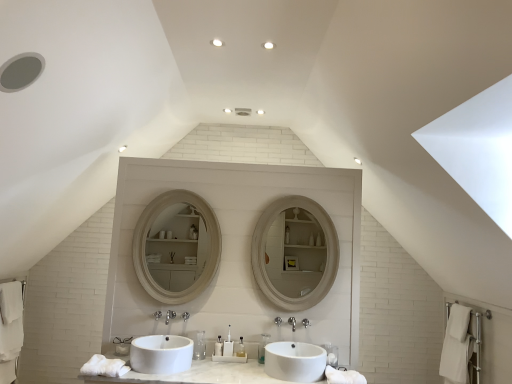
Question: Could you tell me if translucent plastic toothbrush at center, the 1th toiletry in the right-to-left sequence, is facing matte white mirror at center?

Choices:
 (A) no
 (B) yes

Answer: (A)

Question: Considering the relative positions of translucent plastic toothbrush at center, the 1th toiletry in the right-to-left sequence, and matte white mirror at center in the image provided, is translucent plastic toothbrush at center, the 1th toiletry in the right-to-left sequence, in front of matte white mirror at center?

Choices:
 (A) no
 (B) yes

Answer: (B)

Question: Is translucent plastic toothbrush at center, arranged as the 6th toiletry when viewed from the left, shorter than matte white mirror at center?

Choices:
 (A) yes
 (B) no

Answer: (A)

Question: Considering the relative sizes of translucent plastic toothbrush at center, the 1th toiletry in the right-to-left sequence, and matte white mirror at center in the image provided, is translucent plastic toothbrush at center, the 1th toiletry in the right-to-left sequence, thinner than matte white mirror at center?

Choices:
 (A) yes
 (B) no

Answer: (B)

Question: Is translucent plastic toothbrush at center, arranged as the 6th toiletry when viewed from the left, outside of matte white mirror at center?

Choices:
 (A) yes
 (B) no

Answer: (A)

Question: From the image's perspective, is matte white mirror at center above or below clear plastic bottle at center, the 6th toiletry from the right?

Choices:
 (A) above
 (B) below

Answer: (A)

Question: Considering the positions of matte white mirror at center and clear plastic bottle at center, the 6th toiletry from the right, in the image, is matte white mirror at center wider or thinner than clear plastic bottle at center, the 6th toiletry from the right,?

Choices:
 (A) wide
 (B) thin

Answer: (B)

Question: In the image, is matte white mirror at center on the left side or the right side of clear plastic bottle at center, the 1th toiletry positioned from the left?

Choices:
 (A) left
 (B) right

Answer: (B)

Question: Relative to clear plastic bottle at center, the 1th toiletry positioned from the left, is matte white mirror at center in front or behind?

Choices:
 (A) behind
 (B) front

Answer: (A)

Question: From a real-world perspective, is clear plastic toothbrush at center, the fifth toiletry positioned from the left, physically located above or below brushed metal faucet at center, the first plumbing fixture from the left?

Choices:
 (A) above
 (B) below

Answer: (B)

Question: In terms of width, does clear plastic toothbrush at center, acting as the 2th toiletry starting from the right, look wider or thinner when compared to brushed metal faucet at center, which is the 2th plumbing fixture from right to left?

Choices:
 (A) wide
 (B) thin

Answer: (B)

Question: Based on their sizes in the image, would you say clear plastic toothbrush at center, the fifth toiletry positioned from the left, is bigger or smaller than brushed metal faucet at center, the first plumbing fixture from the left?

Choices:
 (A) big
 (B) small

Answer: (A)

Question: From the image's perspective, is clear plastic toothbrush at center, the fifth toiletry positioned from the left, above or below brushed metal faucet at center, the first plumbing fixture from the left?

Choices:
 (A) above
 (B) below

Answer: (B)

Question: From a real-world perspective, is translucent plastic toothbrush at center, which is counted as the third toiletry, starting from the left, physically located above or below translucent plastic toothbrush at center, the second toiletry from the left?

Choices:
 (A) below
 (B) above

Answer: (A)

Question: Is translucent plastic toothbrush at center, arranged as the 4th toiletry when viewed from the right, to the left or to the right of translucent plastic toothbrush at center, the second toiletry from the left, in the image?

Choices:
 (A) right
 (B) left

Answer: (A)